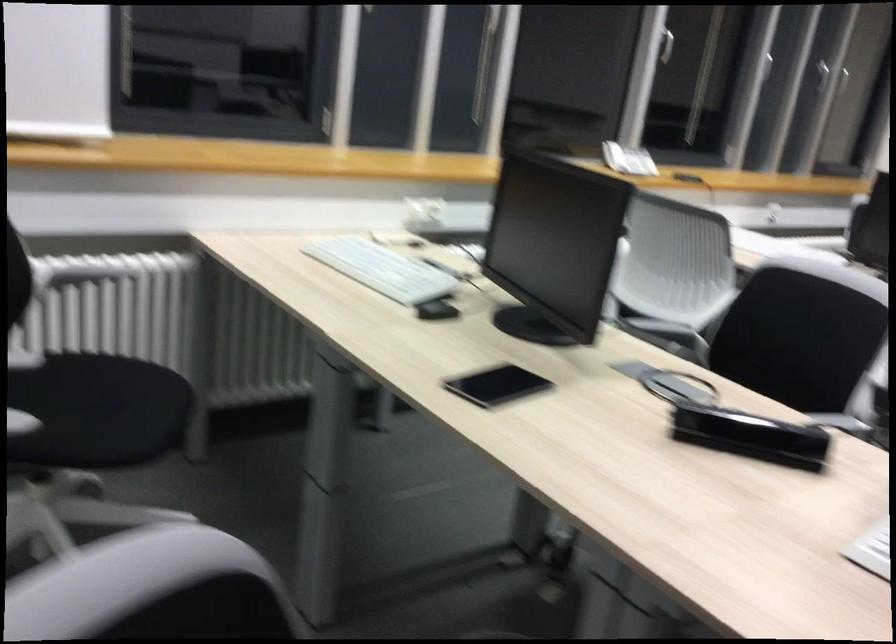
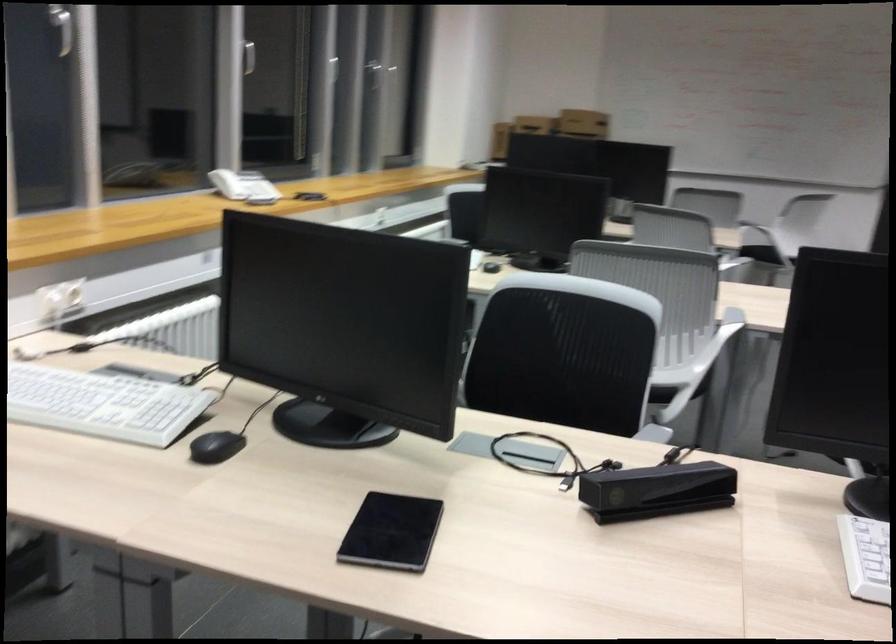
Question: I am providing you with two images of the same scene from different viewpoints. Which of the following objects are not visible in image2?

Choices:
 (A) black tablet
 (B) pink metal bucket
 (C) window handle
 (D) silver window handle

Answer: (D)